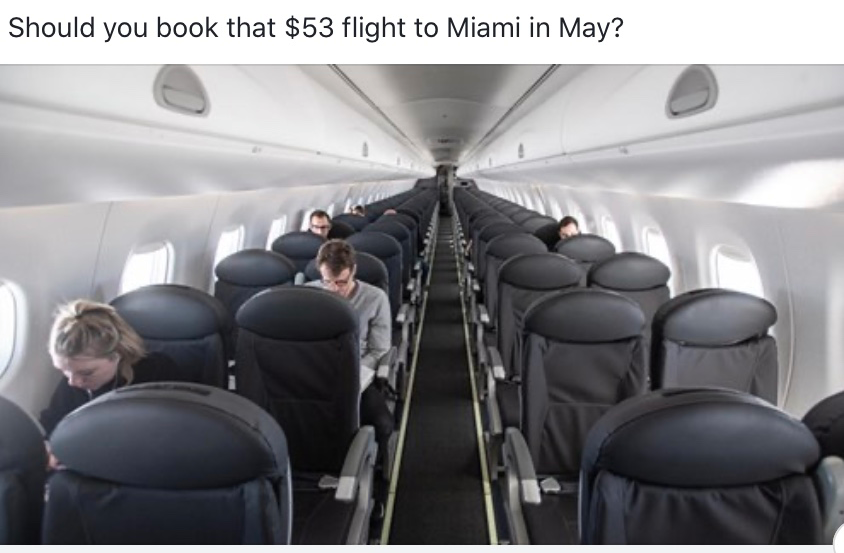
This screenshot has height=553, width=844. I want to click on book (text), so click(197, 30).